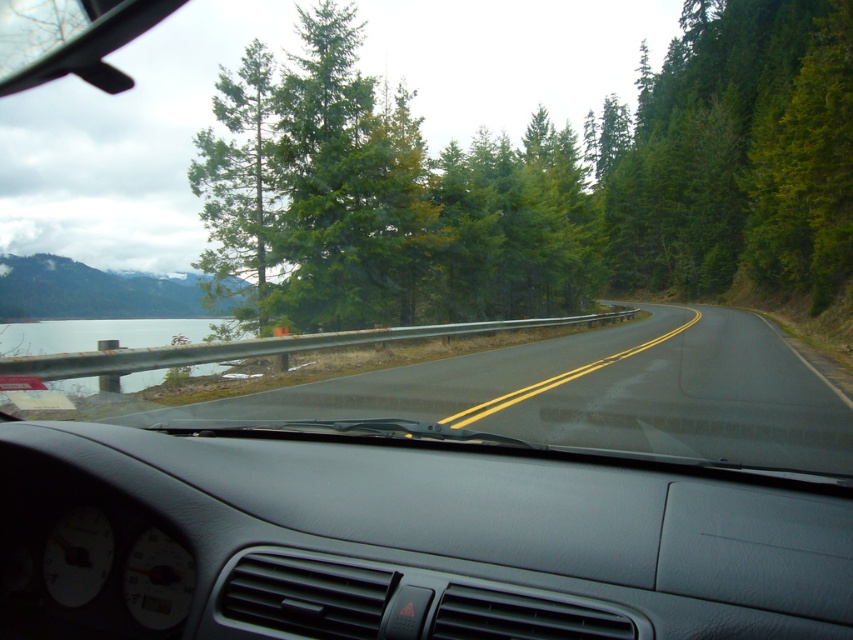
You are driving a car and want to know if there is enough space between the green textured tree at center and the green textured pine tree at upper center to safely pass another vehicle. Can you determine this based on the distance provided?

The distance between the green textured tree at center and the green textured pine tree at upper center is 31.67 meters. However, the provided information does not specify the width of the road or the required safe passing distance for vehicles, so it is not possible to determine if there is enough space to safely pass another vehicle based solely on this distance.

You are driving a car and need to cross the black asphalt road at center. There is a clear glass water at left nearby. Which direction should you turn to avoid the water?

The black asphalt road at center is to the right of clear glass water at left, so you should turn right to avoid the water and stay on the road.